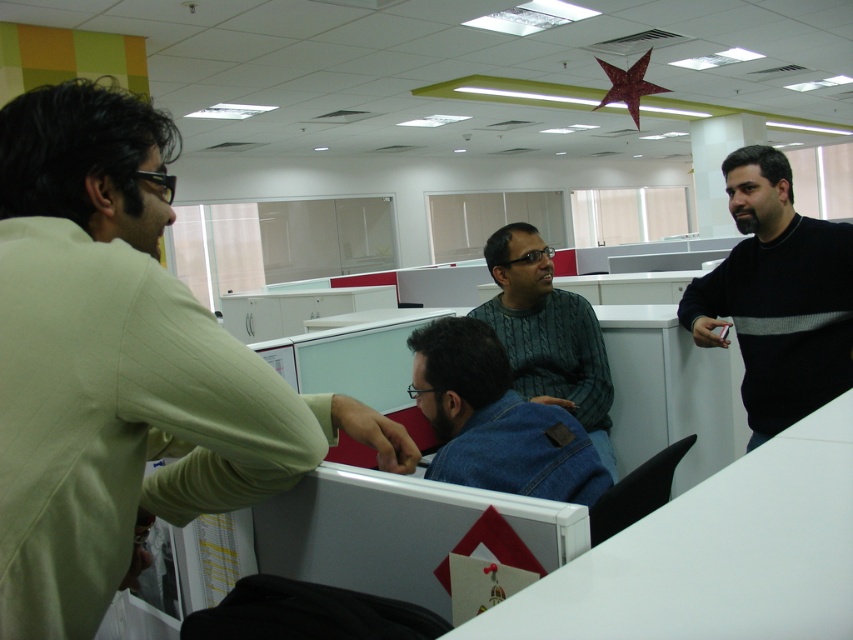
Does point (90, 84) lie behind point (524, 465)?

That is False.

Which of these two, light beige shirt at left or denim jacket at center, stands taller?

light beige shirt at left

Between point (195, 506) and point (430, 417), which one is positioned behind?

The point (430, 417) is more distant.

In order to click on light beige shirt at left in this screenshot , I will do `click(120, 368)`.

Does light beige shirt at left appear under green knitted sweater at center?

Actually, light beige shirt at left is above green knitted sweater at center.

Is light beige shirt at left wider than green knitted sweater at center?

Indeed, light beige shirt at left has a greater width compared to green knitted sweater at center.

Is point (357, 401) in front of point (482, 317)?

Yes, it is in front of point (482, 317).

Identify the location of light beige shirt at left. (120, 368).

Is point (788, 378) farther from camera compared to point (584, 401)?

No.

Is black sweater at right further to the viewer compared to green knitted sweater at center?

Yes, it is behind green knitted sweater at center.

Describe the element at coordinates (776, 296) in the screenshot. The width and height of the screenshot is (853, 640). I see `black sweater at right` at that location.

You are a GUI agent. You are given a task and a screenshot of the screen. Output one action in this format:
    pyautogui.click(x=<x>, y=<y>)
    Task: Click on the black sweater at right
    
    Given the screenshot: What is the action you would take?
    pyautogui.click(x=776, y=296)